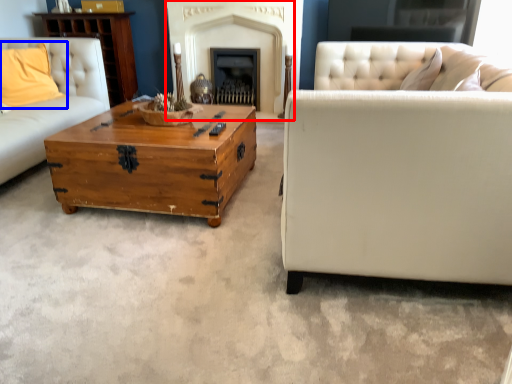
Question: Among these objects, which one is nearest to the camera, fireplace (highlighted by a red box) or pillow (highlighted by a blue box)?

Choices:
 (A) fireplace
 (B) pillow

Answer: (B)